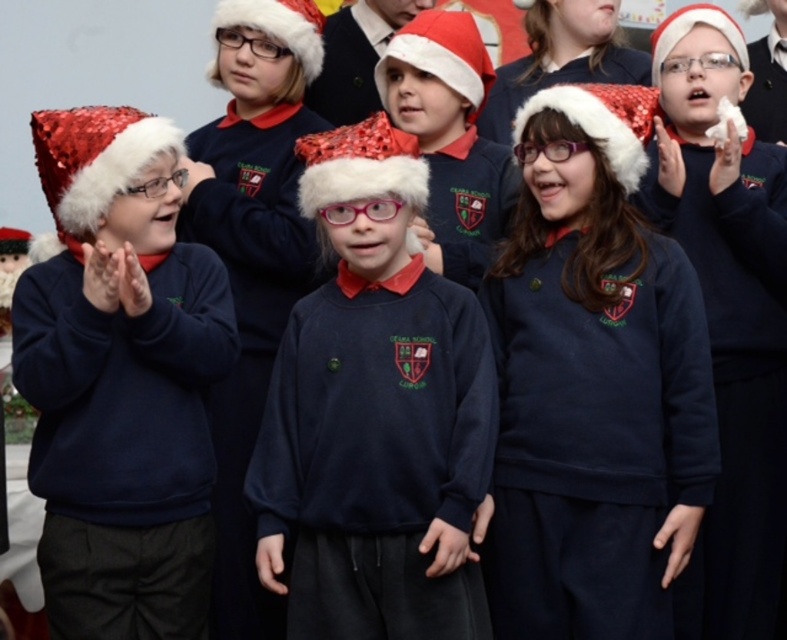
Question: Does matte black sweater at left have a lesser width compared to matte black sweater at center?

Choices:
 (A) no
 (B) yes

Answer: (A)

Question: Can you confirm if matte black sweater at left is positioned to the left of matte black sweater at center?

Choices:
 (A) yes
 (B) no

Answer: (A)

Question: Which point is farther to the camera?

Choices:
 (A) (497, 524)
 (B) (737, 70)
 (C) (390, 388)

Answer: (B)

Question: Which point is closer to the camera?

Choices:
 (A) matte black sweater at center
 (B) navy blue sweatshirt at center
 (C) navy blue sweater at center

Answer: (C)

Question: Can you confirm if navy blue sweater at center is positioned to the right of matte black sweater at left?

Choices:
 (A) no
 (B) yes

Answer: (B)

Question: Which object is the closest to the matte black sweater at center?

Choices:
 (A) navy blue sweatshirt at center
 (B) matte black sweater at left

Answer: (A)